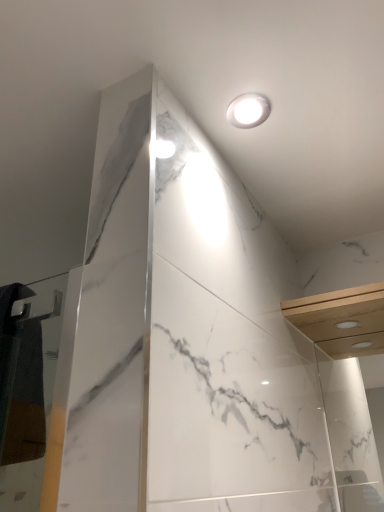
Locate an element on the screen. This screenshot has width=384, height=512. unoccupied region to the right of white glossy light fixture at upper center is located at coordinates (326, 113).